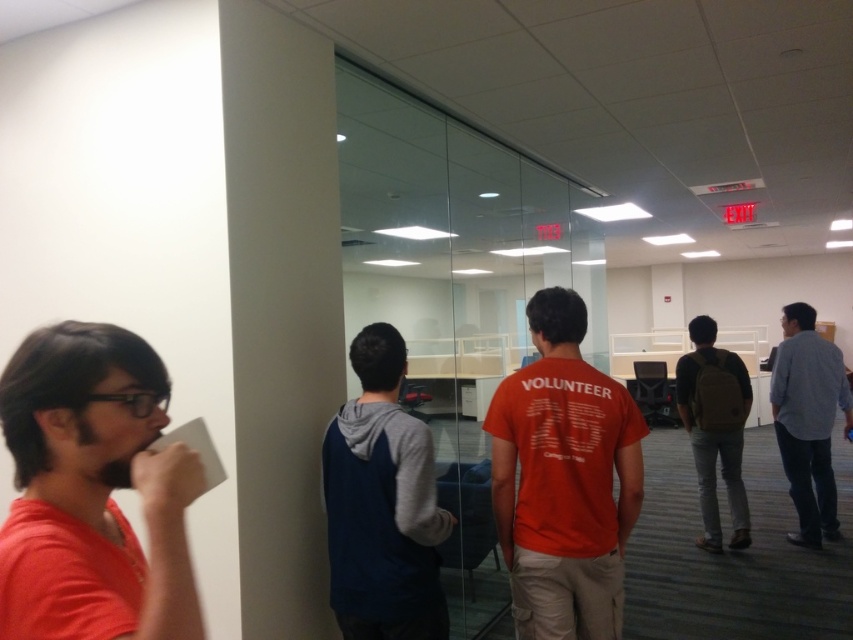
Question: Which point is farther to the camera?

Choices:
 (A) orange cotton t-shirt at center
 (B) brown leather backpack at center-right

Answer: (B)

Question: Can you confirm if dark blue hoodie at center is wider than blue denim shirt at center?

Choices:
 (A) no
 (B) yes

Answer: (A)

Question: Is orange matte t-shirt at left further to the viewer compared to orange cotton t-shirt at center?

Choices:
 (A) no
 (B) yes

Answer: (A)

Question: Does blue denim shirt at center lie in front of brown leather backpack at center-right?

Choices:
 (A) no
 (B) yes

Answer: (A)

Question: Estimate the real-world distances between objects in this image. Which object is closer to the brown leather backpack at center-right?

Choices:
 (A) blue denim shirt at center
 (B) orange matte t-shirt at left

Answer: (A)

Question: Among these points, which one is nearest to the camera?

Choices:
 (A) (352, 444)
 (B) (61, 604)

Answer: (B)